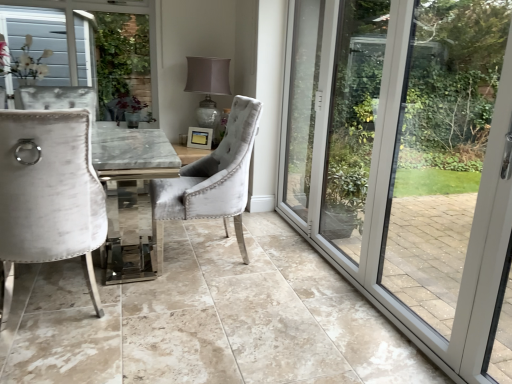
In order to click on vacant region to the right of velvet white chair at left, placed as the 1th chair when sorted from left to right in this screenshot , I will do click(x=153, y=311).